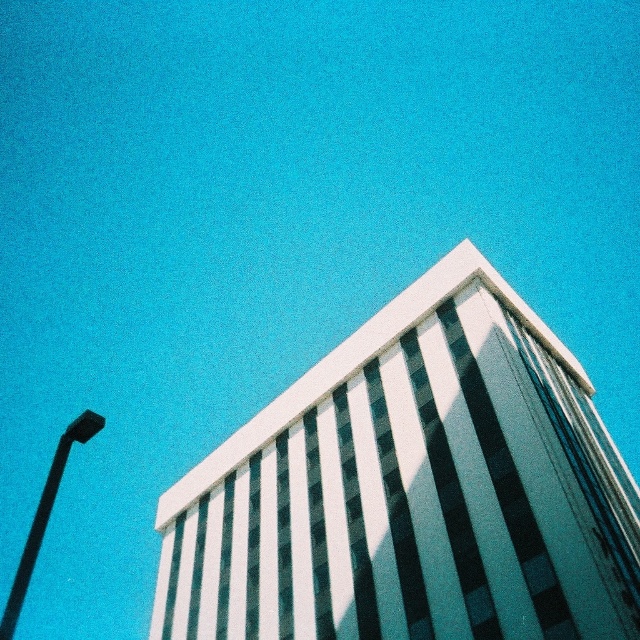
Question: Which point is farther to the camera?

Choices:
 (A) (493, 593)
 (B) (49, 472)

Answer: (A)

Question: Does white glass building at center have a smaller size compared to black plastic lamp post at left?

Choices:
 (A) yes
 (B) no

Answer: (A)

Question: Which object appears farthest from the camera in this image?

Choices:
 (A) white glass building at center
 (B) black plastic lamp post at left

Answer: (A)

Question: Can you confirm if white glass building at center is positioned above black plastic lamp post at left?

Choices:
 (A) no
 (B) yes

Answer: (B)

Question: Is white glass building at center thinner than black plastic lamp post at left?

Choices:
 (A) no
 (B) yes

Answer: (A)

Question: Which point is farther from the camera taking this photo?

Choices:
 (A) (61, 454)
 (B) (452, 314)

Answer: (B)